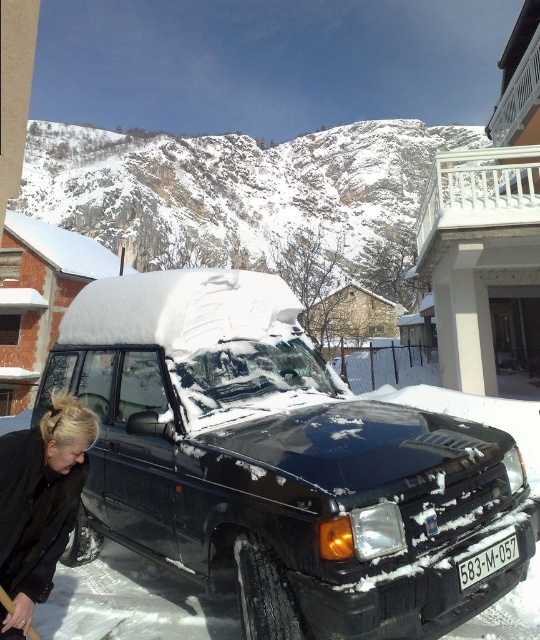
Based on the photo, you are a delivery driver who needs to load a package onto the roof of the black matte van at center. The package is 1.5 meters tall. Considering the height of the van and the position of the black plastic license plate at lower center, can you safely place the package on the roof without it hitting any obstacles?

The black matte van at center is much taller than the black plastic license plate at lower center. Since the license plate is at a lower position, the van has sufficient height to accommodate a 1.5 meter tall package on its roof without hitting any obstacles.

You are a delivery person trying to read the license plate number of the black Land Rover Discovery parked on the snowy driveway. However, you notice the blonde hair at lower left and the black plastic license plate at lower center. Which object is blocking your view of the license plate?

The blonde hair at lower left is positioned over the black plastic license plate at lower center, so the blonde hair at lower left is blocking the view of the license plate.